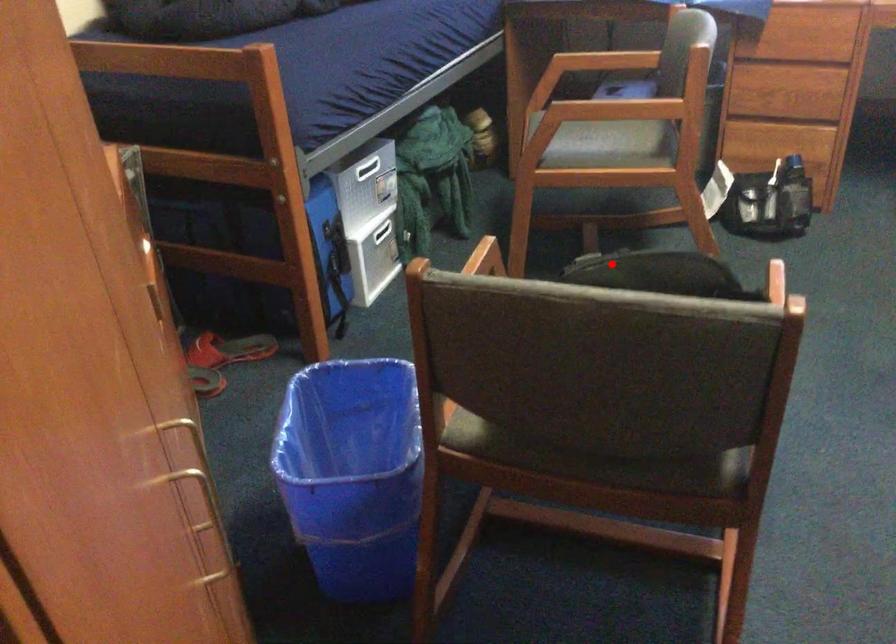
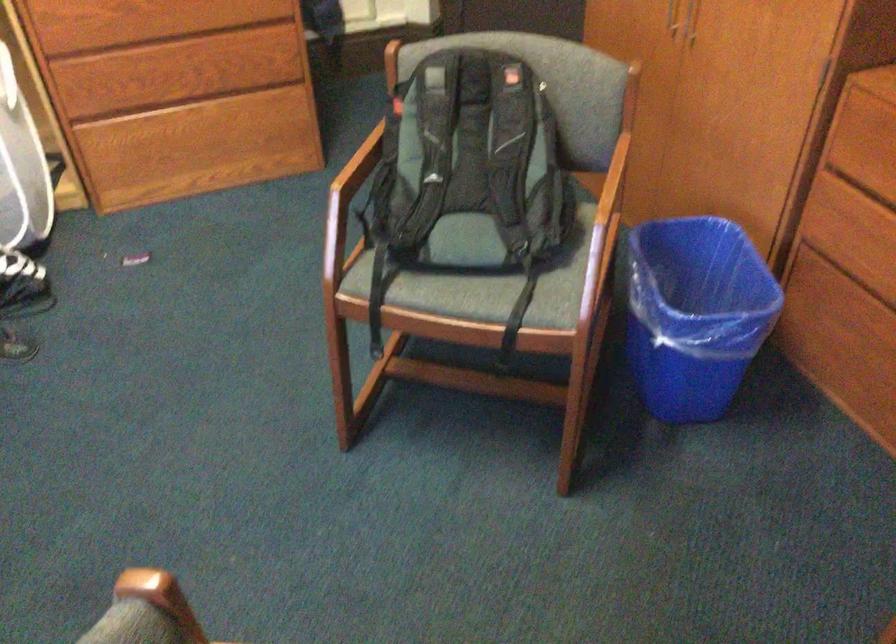
Question: I am providing you with two images of the same scene from different viewpoints. In image1, a red point is highlighted. Considering the same 3D point in image2, which of the following is correct?

Choices:
 (A) It is closer
 (B) It is farther

Answer: (B)